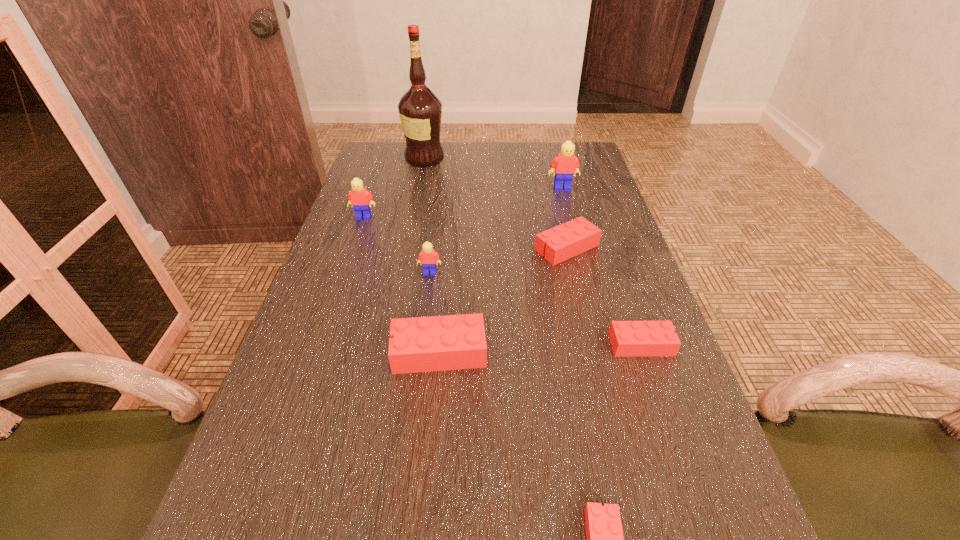
This screenshot has height=540, width=960. I want to click on vacant space that is in between the second shortest object and the fourth tallest Lego, so click(x=540, y=348).

Identify the location of vacant area that lies between the second smallest yellow Lego and the fourth shortest Lego. (401, 285).

The width and height of the screenshot is (960, 540). Identify the location of vacant space that is in between the third smallest red Lego and the farthest object. (495, 203).

I want to click on vacant point located between the seventh shortest object and the alcohol, so click(x=493, y=173).

The height and width of the screenshot is (540, 960). In order to click on free space between the farthest yellow Lego and the third tallest Lego in this screenshot , I will do `click(496, 231)`.

Select which object is the fifth closest to the tallest Lego. Please provide its 2D coordinates. Your answer should be formatted as a tuple, i.e. [(x, y)], where the tuple contains the x and y coordinates of a point satisfying the conditions above.

[(628, 338)]

Locate an element on the screen. The width and height of the screenshot is (960, 540). object that is the second closest one to the tallest Lego is located at coordinates (420, 110).

Where is `Lego that is the fourth closest one to the third biggest red Lego`? Lego that is the fourth closest one to the third biggest red Lego is located at coordinates (428, 256).

Find the location of a particular element. Lego that is the fifth closest to the biggest red Lego is located at coordinates (358, 197).

Choose which yellow Lego is the second nearest neighbor to the fourth nearest object. Please provide its 2D coordinates. Your answer should be formatted as a tuple, i.e. [(x, y)], where the tuple contains the x and y coordinates of a point satisfying the conditions above.

[(565, 164)]